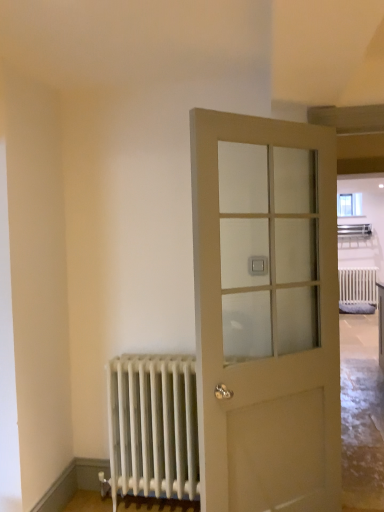
Question: Would you say matte glass door at center is a long distance from white metallic radiator at lower left?

Choices:
 (A) no
 (B) yes

Answer: (A)

Question: From a real-world perspective, does matte glass door at center stand above white metallic radiator at lower left?

Choices:
 (A) yes
 (B) no

Answer: (A)

Question: Considering the relative positions of matte glass door at center and white metallic radiator at lower left in the image provided, is matte glass door at center to the left of white metallic radiator at lower left from the viewer's perspective?

Choices:
 (A) yes
 (B) no

Answer: (B)

Question: Considering the relative positions of matte glass door at center and white metallic radiator at lower left in the image provided, is matte glass door at center to the right of white metallic radiator at lower left from the viewer's perspective?

Choices:
 (A) yes
 (B) no

Answer: (A)

Question: Is matte glass door at center shorter than white metallic radiator at lower left?

Choices:
 (A) yes
 (B) no

Answer: (B)

Question: From the image's perspective, does matte glass door at center appear lower than white metallic radiator at lower left?

Choices:
 (A) yes
 (B) no

Answer: (B)

Question: Does white metallic radiator at lower left touch matte glass door at center?

Choices:
 (A) yes
 (B) no

Answer: (B)

Question: Is white metallic radiator at lower left positioned in front of matte glass door at center?

Choices:
 (A) yes
 (B) no

Answer: (B)

Question: Does white metallic radiator at lower left have a lesser height compared to matte glass door at center?

Choices:
 (A) yes
 (B) no

Answer: (A)

Question: Is white metallic radiator at lower left positioned far away from matte glass door at center?

Choices:
 (A) no
 (B) yes

Answer: (A)

Question: Does white metallic radiator at lower left lie behind matte glass door at center?

Choices:
 (A) no
 (B) yes

Answer: (B)

Question: Is matte glass door at center at the back of white metallic radiator at lower left?

Choices:
 (A) no
 (B) yes

Answer: (A)

Question: Is white metallic radiator at lower left bigger or smaller than matte glass door at center?

Choices:
 (A) small
 (B) big

Answer: (A)